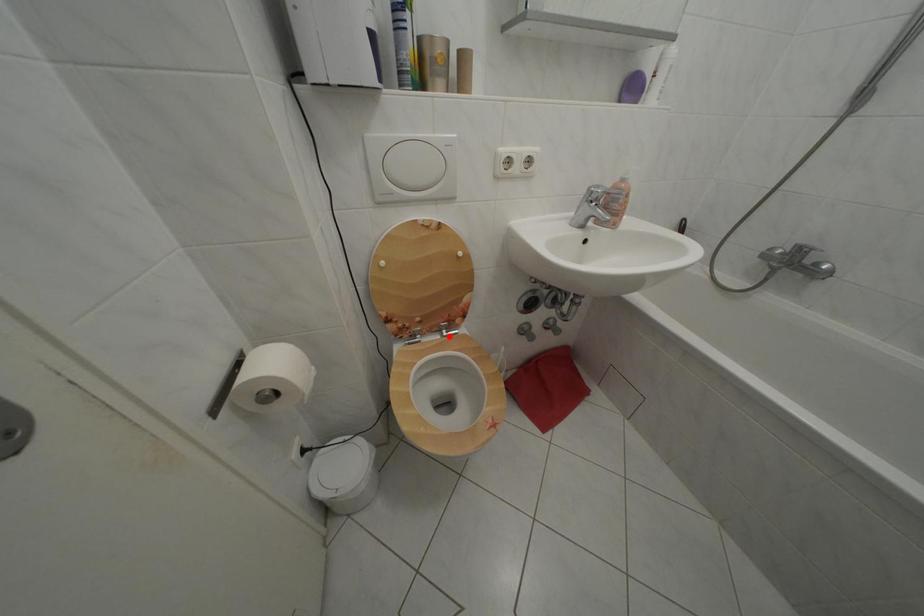
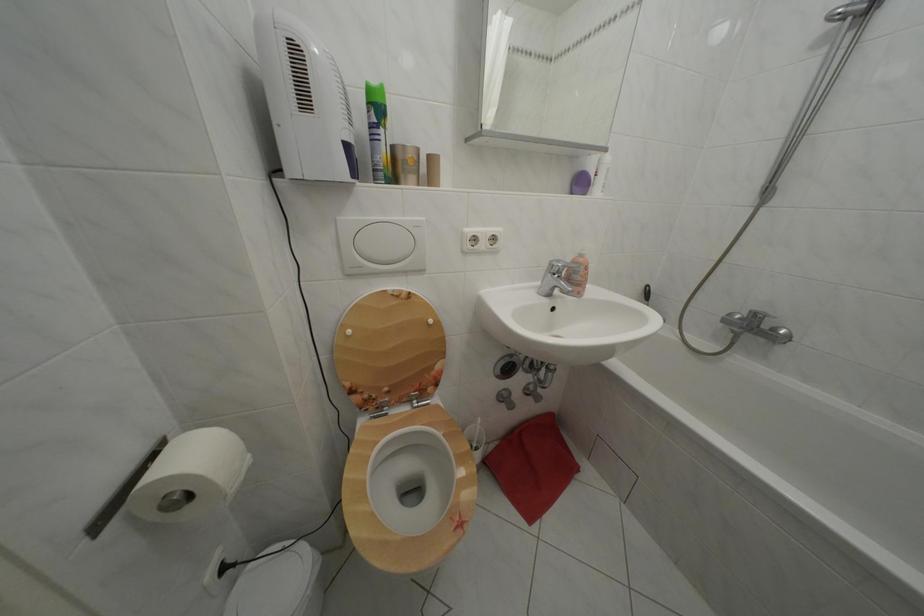
The point at the highlighted location is marked in the first image. Where is the corresponding point in the second image?

(419, 407)